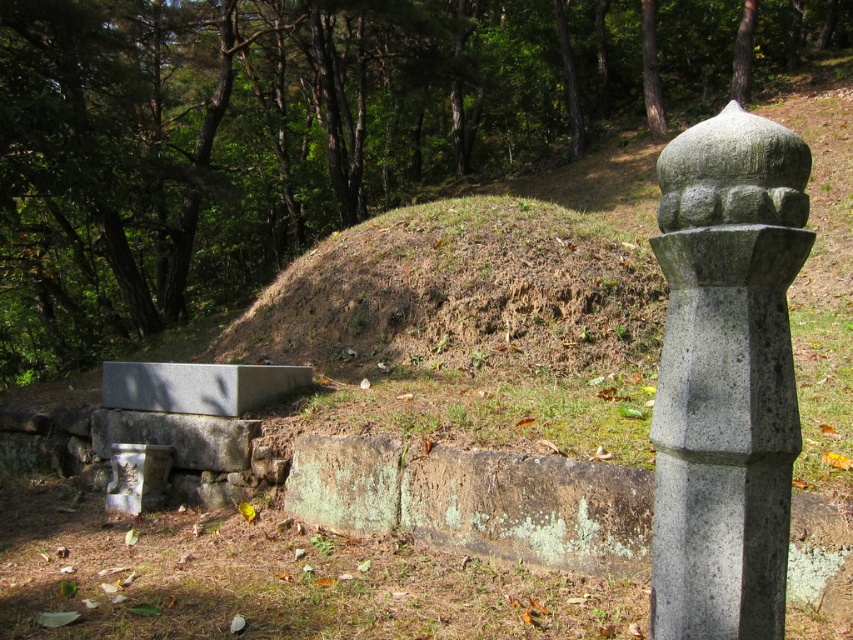
You are planning to place a small garden statue on the highest point in this area. Which object should you choose between the brown grassy mound at center and the gray concrete bench at lower left?

The brown grassy mound at center has a greater height compared to the gray concrete bench at lower left, so you should place the statue on the brown grassy mound at center.

Based on the photo, you are standing at the base of the stone column in the forest scene. You notice a green leafy tree at upper center. If you face directly towards the tree, which direction should you turn to look towards the low stone wall that runs parallel to the column?

The low stone wall runs parallel to the column. Since the green leafy tree at upper center is located at coordinates point (308, 129), you should turn to your left to face the low stone wall that is parallel to the column.